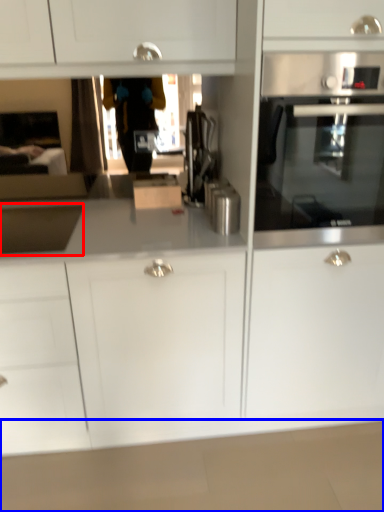
Question: Which object appears closest to the camera in this image, sink (highlighted by a red box) or counter top (highlighted by a blue box)?

Choices:
 (A) sink
 (B) counter top

Answer: (A)